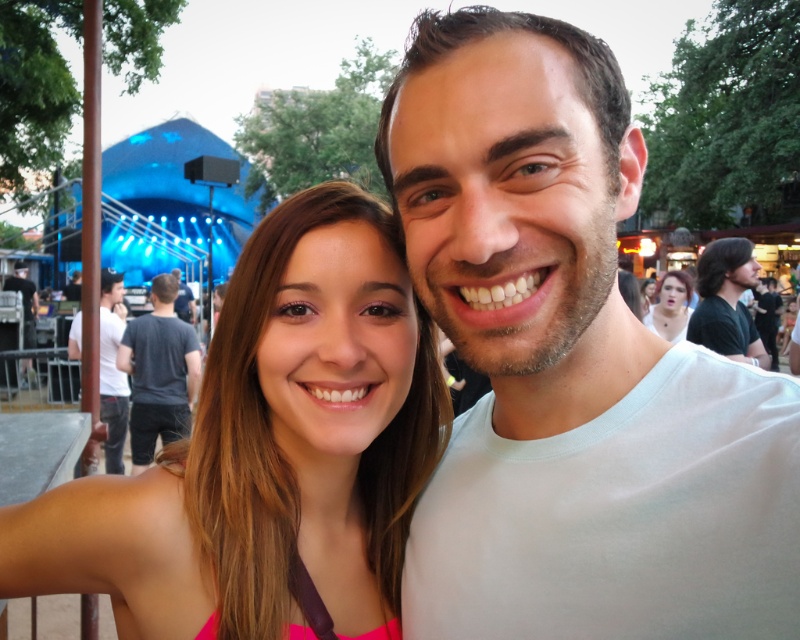
You are a photographer trying to capture a clear shot of both the white matte shirt at center and the pink fabric dress at center. Since you can only focus on one subject at a time, which one should you choose to ensure the other is still somewhat in focus?

The white matte shirt at center is closer to the viewer than the pink fabric dress at center. Therefore, focusing on the white matte shirt at center would keep the pink fabric dress at center in better focus compared to focusing on the latter.

You are at a festival and want to take a photo of the stage. You notice the white matte shirt at center and the black cotton shirt at right in your viewfinder. Which shirt should you adjust your camera angle to avoid blocking the stage?

The white matte shirt at center is positioned under the black cotton shirt at right, so adjusting the camera angle to move the white matte shirt at center out of the frame would prevent it from blocking the stage.